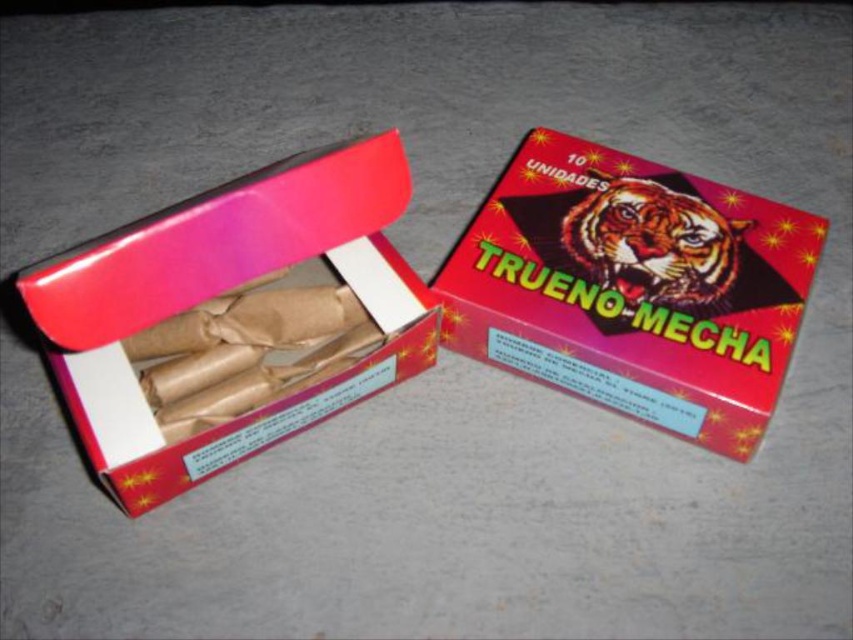
You are examining the fireworks box and notice two points marked on it. The first point is at coordinates point (346, 248) and the second is at point (711, 236). If you were to touch both points simultaneously with your fingers, which point would feel closer to your hand?

Point (346, 248) is closer to the camera than point (711, 236), so touching both points simultaneously, the point (346, 248) would feel closer to your hand.

You are a delivery person who needs to place a new box on the shelf. The shelf has limited space between the shiny red cardboard box at center and the matte cardboard box at left. What is the maximum length of the new box you can safely place between them without overlapping?

The maximum length of the new box you can safely place between the shiny red cardboard box at center and the matte cardboard box at left is 13.28 inches, as that is the distance between them.